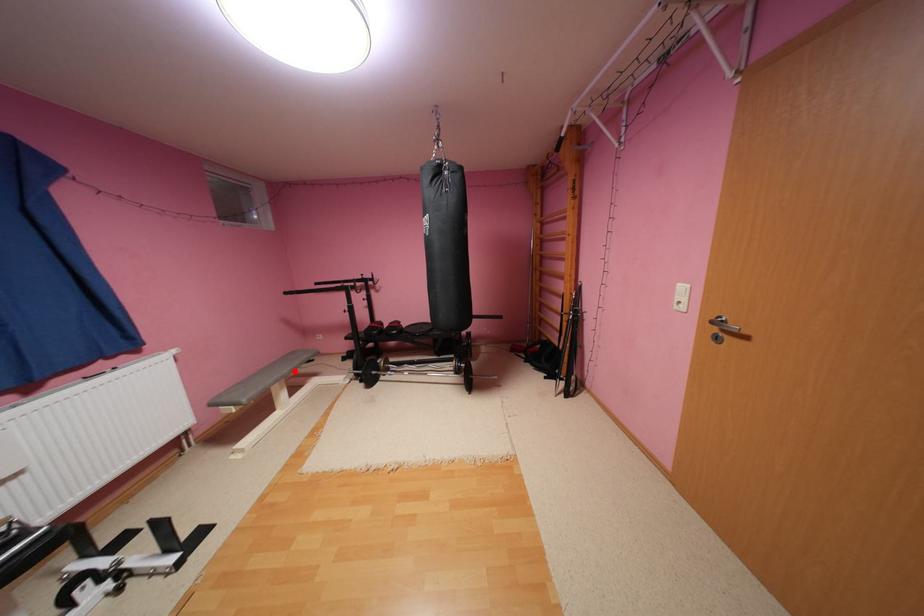
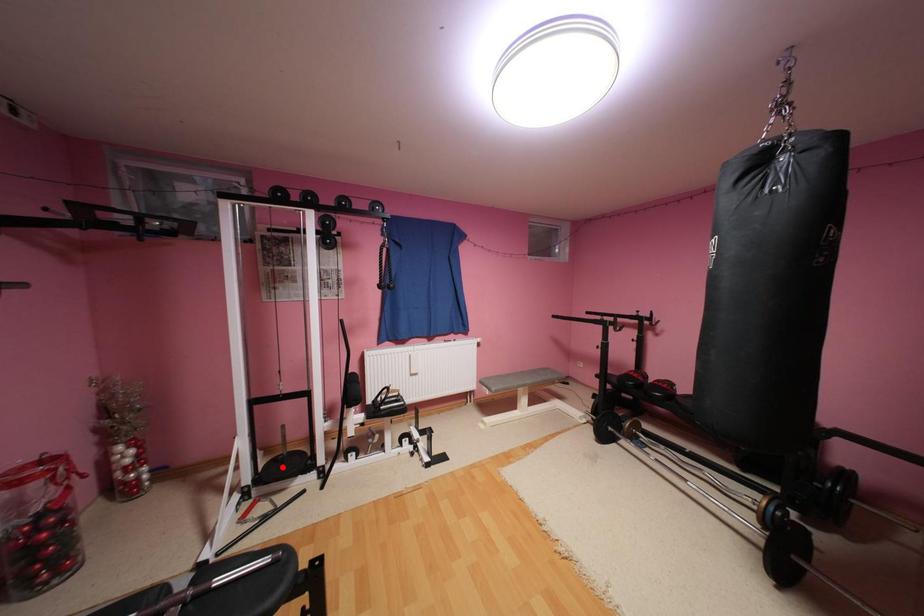
I am providing you with two images of the same scene from different viewpoints. A red point is marked on the first image and another point is marked on the second image. Does the point marked in image1 correspond to the same location as the one in image2?

No